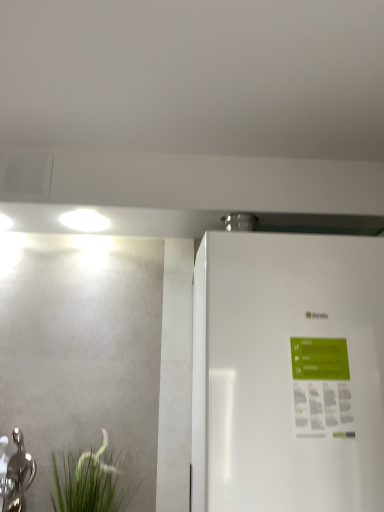
Question: Considering the relative positions of white glossy refrigerator at right and silver metallic tap at lower left in the image provided, is white glossy refrigerator at right to the left or to the right of silver metallic tap at lower left?

Choices:
 (A) right
 (B) left

Answer: (A)

Question: From a real-world perspective, is white glossy refrigerator at right above or below silver metallic tap at lower left?

Choices:
 (A) below
 (B) above

Answer: (B)

Question: Estimate the real-world distances between objects in this image. Which object is farther from the silver metallic tap at lower left?

Choices:
 (A) green matte plant at lower left
 (B) white glossy refrigerator at right

Answer: (B)

Question: Considering the real-world distances, which object is farthest from the white glossy refrigerator at right?

Choices:
 (A) green matte plant at lower left
 (B) silver metallic tap at lower left

Answer: (B)